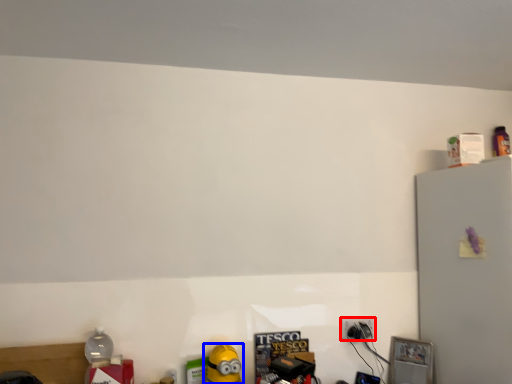
Question: Which object is closer to the camera taking this photo, power plugs and sockets (highlighted by a red box) or toy (highlighted by a blue box)?

Choices:
 (A) power plugs and sockets
 (B) toy

Answer: (B)